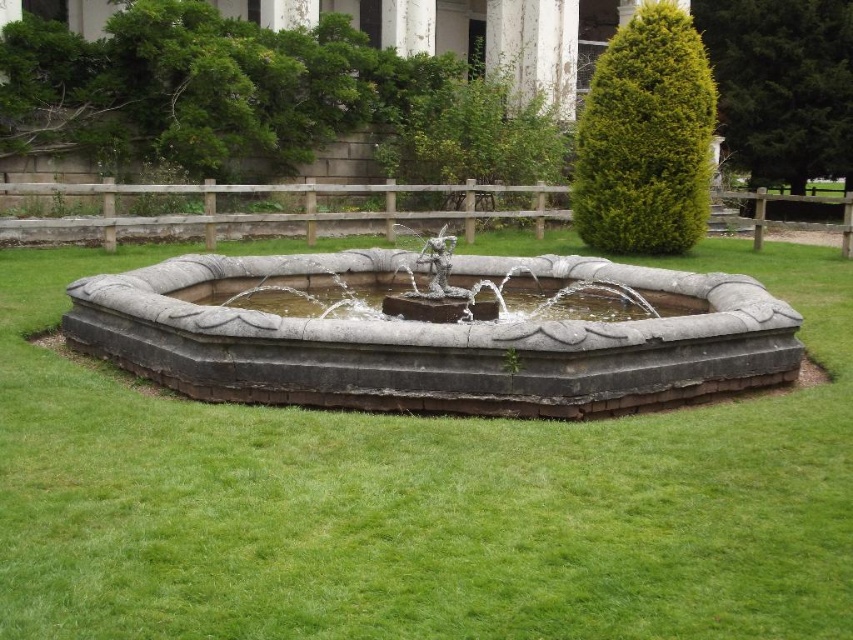
Is green grass at center above clear water at fountain center?

Incorrect, green grass at center is not positioned above clear water at fountain center.

Describe the element at coordinates (419, 497) in the screenshot. The height and width of the screenshot is (640, 853). I see `green grass at center` at that location.

The width and height of the screenshot is (853, 640). I want to click on green grass at center, so click(x=419, y=497).

Which is above, green grass at center or gray stone fountain at center?

gray stone fountain at center is higher up.

Who is more distant from viewer, (x=3, y=470) or (x=219, y=289)?

The point (x=219, y=289) is more distant.

Locate an element on the screen. This screenshot has width=853, height=640. green grass at center is located at coordinates (419, 497).

Is gray stone fountain at center above clear water at fountain center?

Actually, gray stone fountain at center is below clear water at fountain center.

Looking at this image, between gray stone fountain at center and clear water at fountain center, which one has less height?

clear water at fountain center is shorter.

Who is more forward, (93,320) or (282,300)?

Positioned in front is point (93,320).

What are the coordinates of `gray stone fountain at center` in the screenshot? It's located at (433, 337).